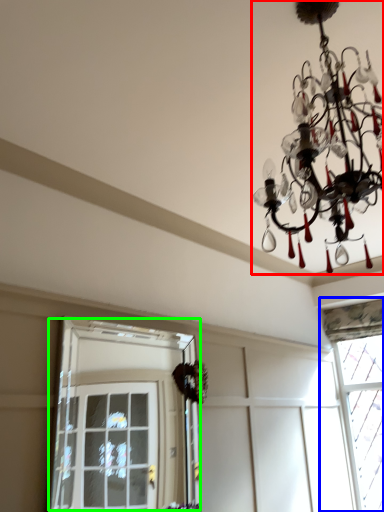
Question: Which is farther away from lamp (highlighted by a red box)? window (highlighted by a blue box) or window (highlighted by a green box)?

Choices:
 (A) window
 (B) window

Answer: (B)